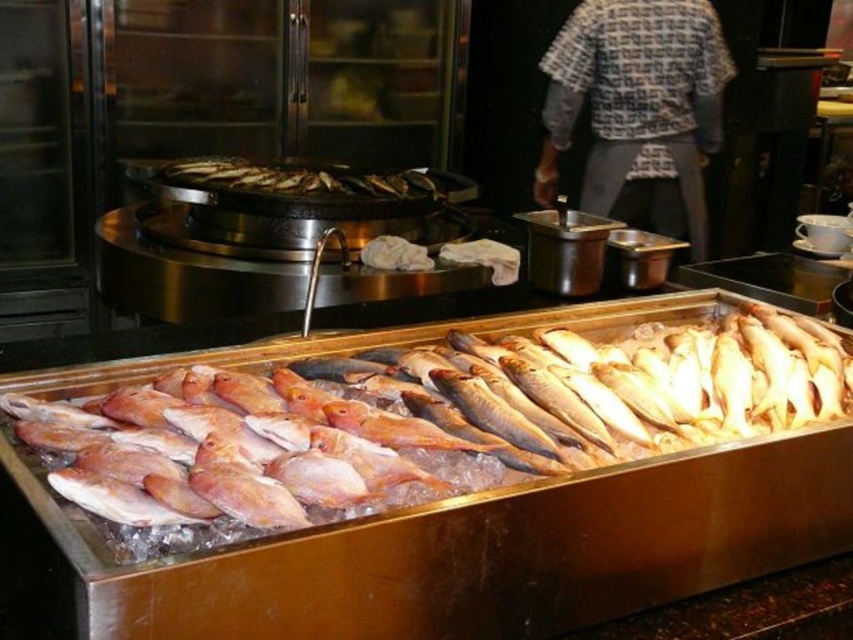
Does patterned fabric shirt at center have a greater height compared to brown matte fish at center?

Yes, patterned fabric shirt at center is taller than brown matte fish at center.

From the picture: Can you confirm if patterned fabric shirt at center is bigger than brown matte fish at center?

Correct, patterned fabric shirt at center is larger in size than brown matte fish at center.

Which is behind, point (583, 51) or point (239, 188)?

Positioned behind is point (583, 51).

Where is `patterned fabric shirt at center`? patterned fabric shirt at center is located at coordinates (637, 109).

Between point (677, 412) and point (646, 29), which one is positioned behind?

The point (646, 29) is behind.

Measure the distance between pinkish-silver fish at center and patterned fabric shirt at center.

pinkish-silver fish at center and patterned fabric shirt at center are 7.00 feet apart.

Identify the location of pinkish-silver fish at center. The height and width of the screenshot is (640, 853). (425, 419).

Which is below, pinkish-silver fish at center or brown matte fish at center?

pinkish-silver fish at center is lower down.

Consider the image. Measure the distance between pinkish-silver fish at center and camera.

pinkish-silver fish at center and camera are 30.64 inches apart from each other.

Locate an element on the screen. The height and width of the screenshot is (640, 853). pinkish-silver fish at center is located at coordinates (425, 419).